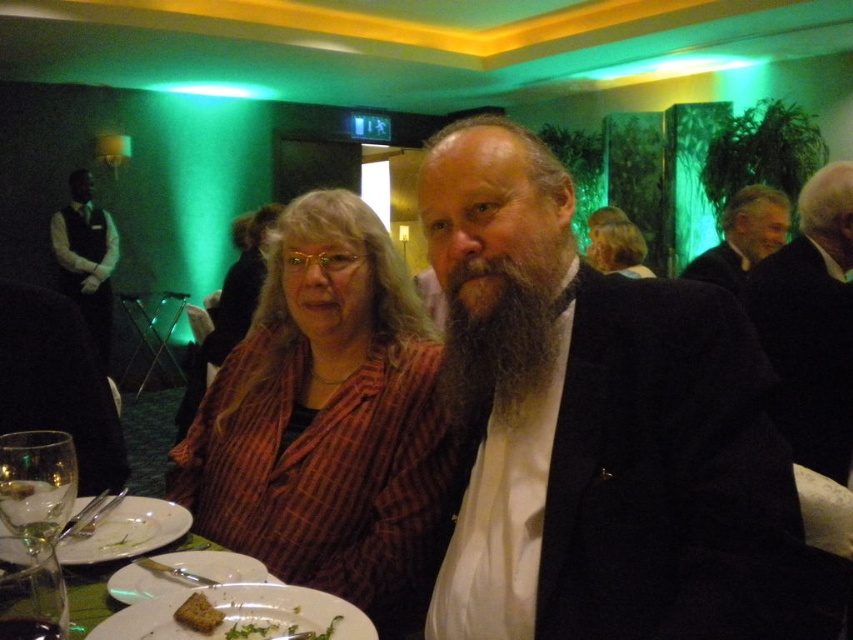
You are a server at the event and need to place a new white ceramic plate at center. Where should you place it based on the existing coordinates?

The white ceramic plate at center should be placed at the coordinates point (181, 573) as specified.

You are a waiter at the banquet hall and need to place a new drink order on the table. The drink must be placed above the black shirt at left. Can you place the drink on the white porcelain plates at center?

The white porcelain plates at center are located below the black shirt at left, so placing the drink on the white porcelain plates at center would be below the required position. You need to place the drink above the black shirt at left instead.